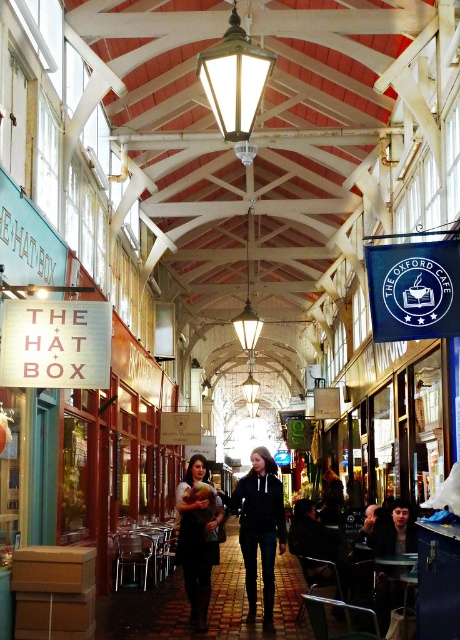
You are standing in the middle of the market corridor and notice two items hanging on a rack at the center. The items are the black hoodie at center and the matte black dress at center. Which item is positioned lower on the rack?

The black hoodie at center is positioned below the matte black dress at center, so it is lower on the rack.

You are a customer in the market and want to purchase a garment that reaches your knees. You see the black hoodie at center and the matte black dress at center. Which one is more likely to be knee length?

The matte black dress at center is shorter than the black hoodie at center, so the black hoodie at center is more likely to be knee length.